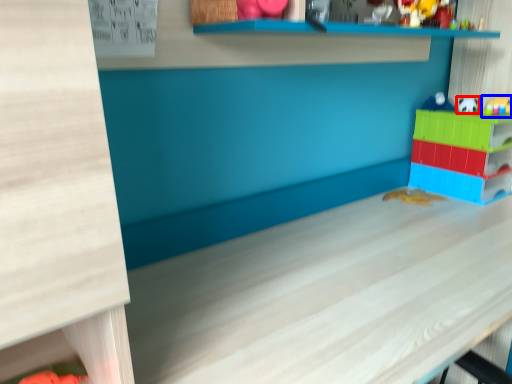
Question: Among these objects, which one is farthest to the camera, toy (highlighted by a red box) or toy (highlighted by a blue box)?

Choices:
 (A) toy
 (B) toy

Answer: (A)